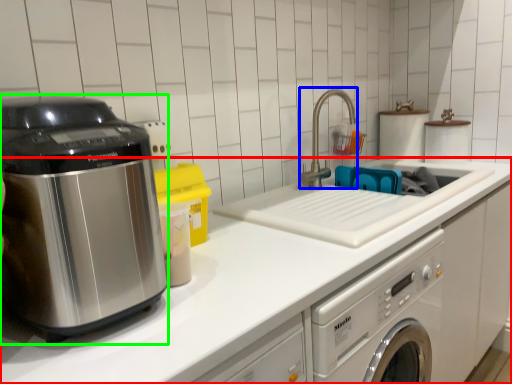
Question: Considering the real-world distances, which object is farthest from countertop (highlighted by a red box)? faucet (highlighted by a blue box) or home appliance (highlighted by a green box)?

Choices:
 (A) faucet
 (B) home appliance

Answer: (A)